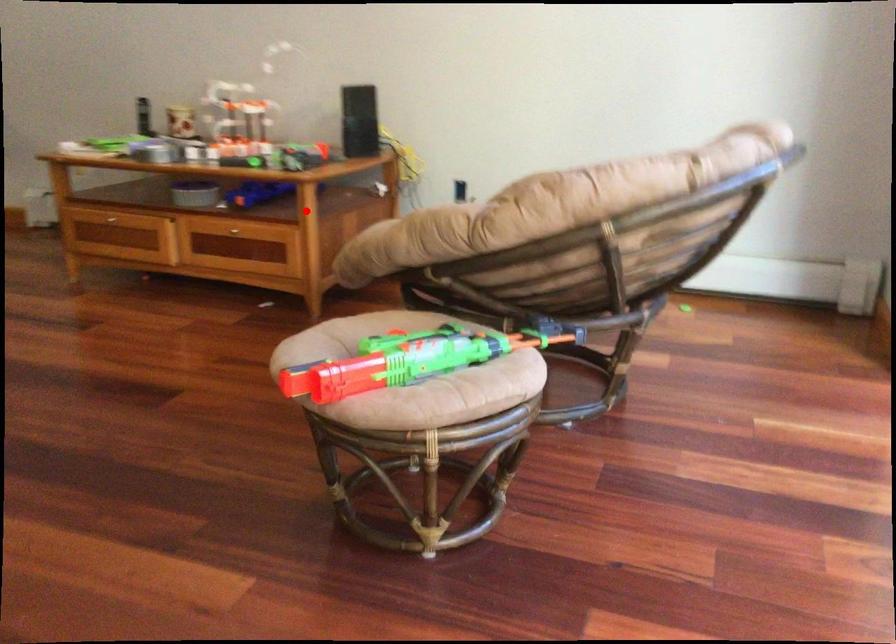
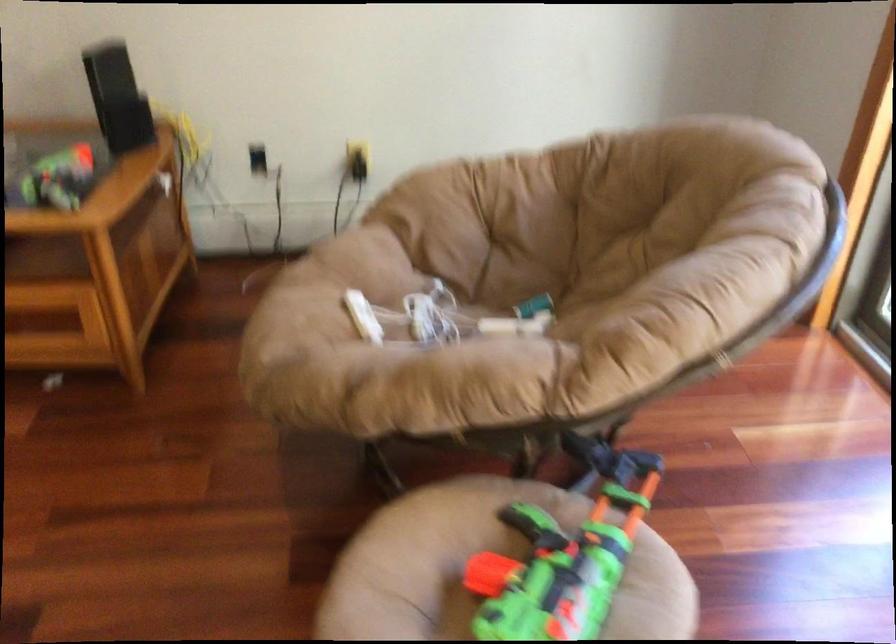
The point at the highlighted location is marked in the first image. Where is the corresponding point in the second image?

(95, 263)